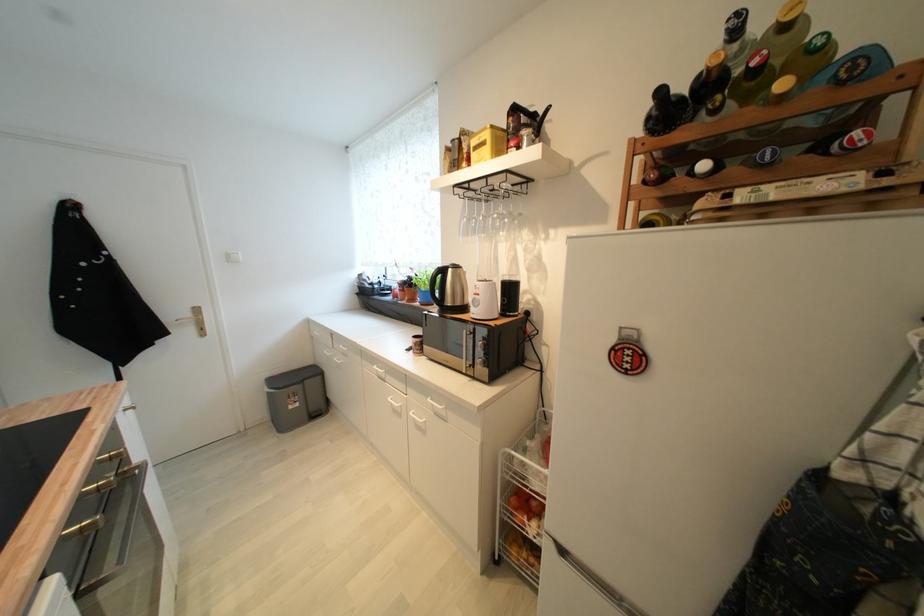
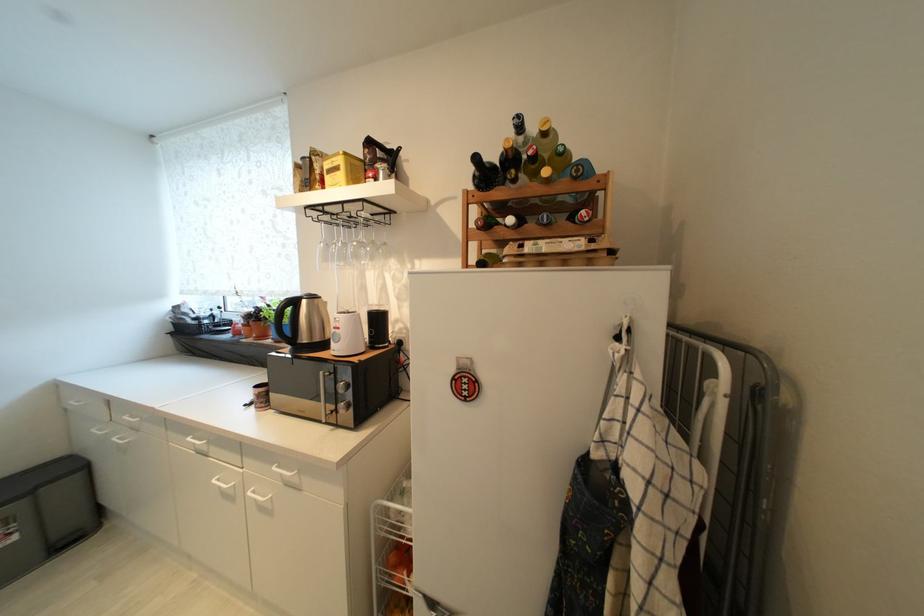
Question: How did the camera likely rotate?

Choices:
 (A) Left
 (B) Right
 (C) Up
 (D) Down

Answer: (B)